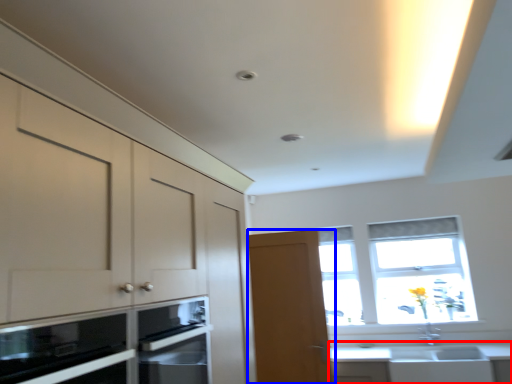
Question: Among these objects, which one is nearest to the camera, countertop (highlighted by a red box) or door (highlighted by a blue box)?

Choices:
 (A) countertop
 (B) door

Answer: (A)